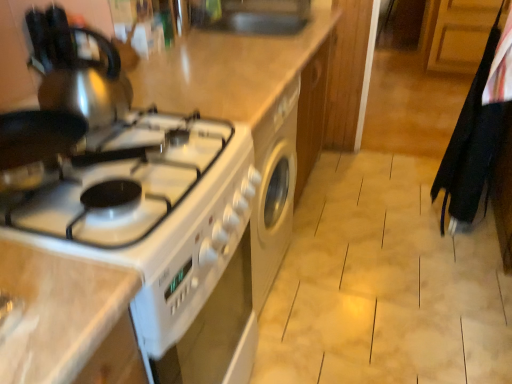
Question: Is white glossy stove at left wider or thinner than black fabric laundry at right?

Choices:
 (A) thin
 (B) wide

Answer: (B)

Question: Is point (257, 59) closer or farther from the camera than point (468, 89)?

Choices:
 (A) closer
 (B) farther

Answer: (A)

Question: Estimate the real-world distances between objects in this image. Which object is closer to the white glossy stove at left?

Choices:
 (A) white glossy gas stove at left
 (B) satin silver kettle at upper left
 (C) black fabric laundry at right

Answer: (A)

Question: Which object is the closest to the white glossy stove at left?

Choices:
 (A) satin silver kettle at upper left
 (B) white glossy gas stove at left
 (C) black fabric laundry at right

Answer: (B)